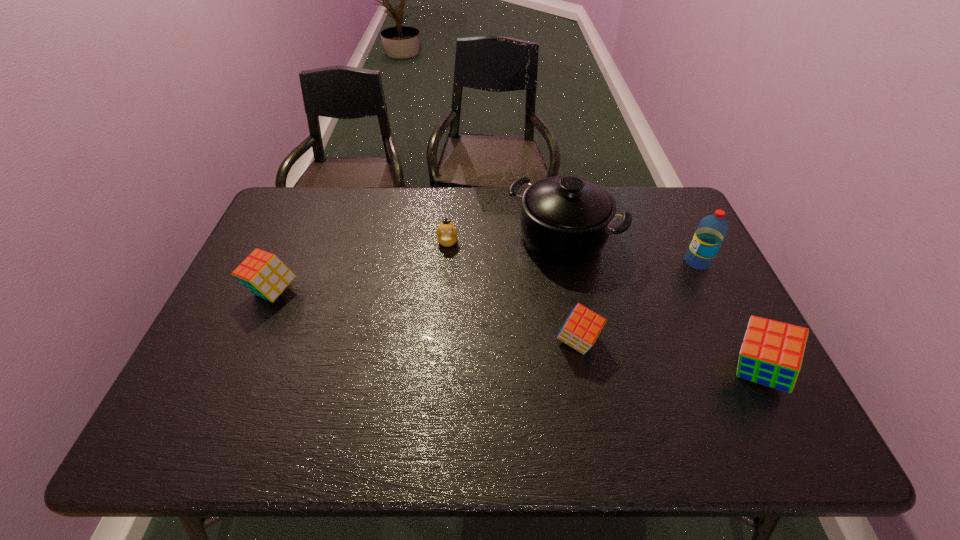
The height and width of the screenshot is (540, 960). I want to click on empty space between the farthest cube and the saucepan, so click(418, 265).

This screenshot has height=540, width=960. Find the location of `empty space between the water bottle and the second cube from left to right`. empty space between the water bottle and the second cube from left to right is located at coordinates (637, 302).

Find the location of a particular element. The height and width of the screenshot is (540, 960). free space between the second cube from left to right and the water bottle is located at coordinates (637, 302).

At what (x,y) coordinates should I click in order to perform the action: click on free space between the saucepan and the shortest object. Please return your answer as a coordinate pair (x, y). Looking at the image, I should click on (505, 241).

I want to click on object that is the second closest to the leftmost cube, so click(x=565, y=220).

Find the location of `object that stands as the second closest to the rightmost cube`. object that stands as the second closest to the rightmost cube is located at coordinates (580, 331).

Where is `cube that stands as the closest to the water bottle`? Image resolution: width=960 pixels, height=540 pixels. cube that stands as the closest to the water bottle is located at coordinates [x=771, y=354].

You are a GUI agent. You are given a task and a screenshot of the screen. Output one action in this format:
    pyautogui.click(x=<x>, y=<y>)
    Task: Click on the cube that is the third closest to the saucepan
    The image size is (960, 540).
    Given the screenshot: What is the action you would take?
    pyautogui.click(x=264, y=274)

The width and height of the screenshot is (960, 540). I want to click on free space in the image that satisfies the following two spatial constraints: 1. on the front side of the farthest cube; 2. on the right side of the rightmost cube, so click(237, 372).

The width and height of the screenshot is (960, 540). Find the location of `vacant position in the image that satisfies the following two spatial constraints: 1. on the face of the shortest object; 2. on the right side of the second cube from left to right`. vacant position in the image that satisfies the following two spatial constraints: 1. on the face of the shortest object; 2. on the right side of the second cube from left to right is located at coordinates (440, 342).